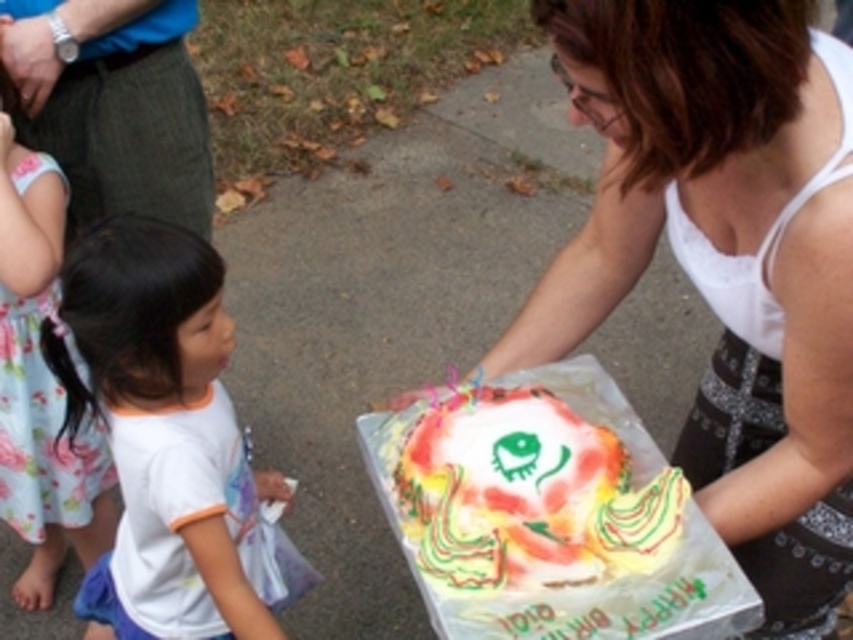
Does white matte tank top at center have a greater width compared to white cotton shirt at lower left?

Yes, white matte tank top at center is wider than white cotton shirt at lower left.

Can you confirm if white matte tank top at center is positioned to the right of white cotton shirt at lower left?

Correct, you'll find white matte tank top at center to the right of white cotton shirt at lower left.

Which is behind, point (819, 525) or point (216, 428)?

The point (216, 428) is behind.

This screenshot has width=853, height=640. Identify the location of white matte tank top at center. (724, 260).

This screenshot has height=640, width=853. What do you see at coordinates (724, 260) in the screenshot?
I see `white matte tank top at center` at bounding box center [724, 260].

Who is lower down, white matte tank top at center or colorful frosting cake at center?

colorful frosting cake at center is below.

Where is `white matte tank top at center`? white matte tank top at center is located at coordinates (724, 260).

This screenshot has width=853, height=640. I want to click on white matte tank top at center, so pyautogui.click(x=724, y=260).

Does white matte tank top at center appear on the left side of floral fabric dress at lower left?

In fact, white matte tank top at center is to the right of floral fabric dress at lower left.

Locate an element on the screen. The width and height of the screenshot is (853, 640). white matte tank top at center is located at coordinates (724, 260).